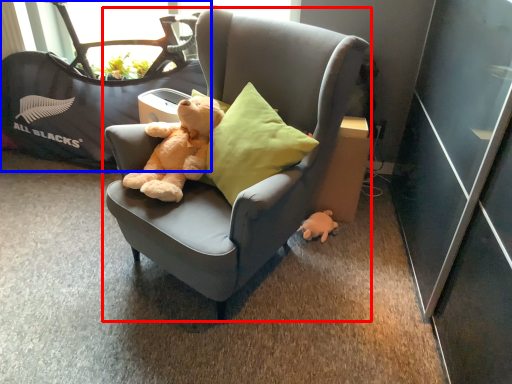
Question: Which of the following is the farthest to the observer, chair (highlighted by a red box) or baby carriage (highlighted by a blue box)?

Choices:
 (A) chair
 (B) baby carriage

Answer: (B)